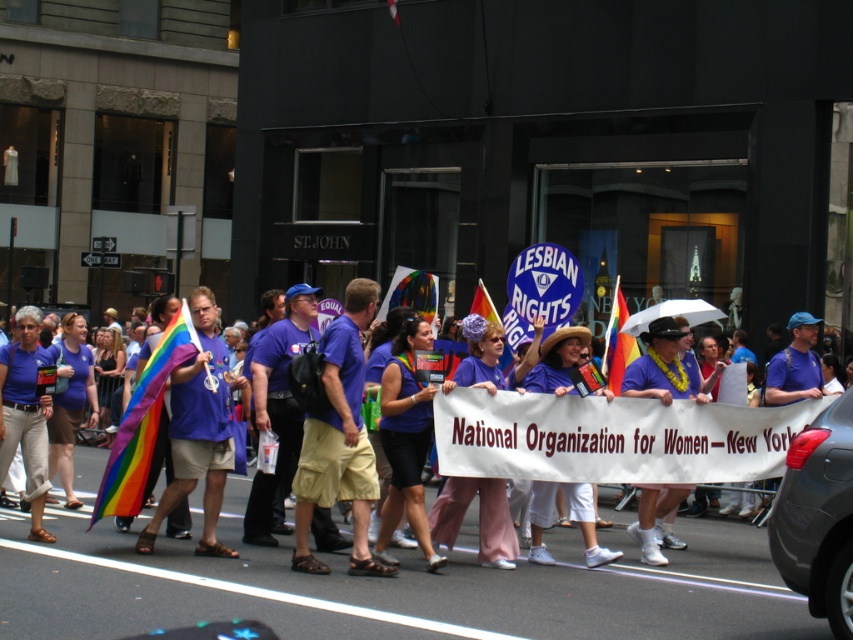
Question: Among these objects, which one is nearest to the camera?

Choices:
 (A) purple fabric shorts at center
 (B) purple cotton shirt at center
 (C) purple fabric shirt at center

Answer: (B)

Question: Does purple fabric at center appear over rainbow fabric flag at left?

Choices:
 (A) no
 (B) yes

Answer: (A)

Question: Can you confirm if purple cotton shirt at center is positioned to the right of purple fabric at center?

Choices:
 (A) yes
 (B) no

Answer: (B)

Question: Which object is closer to the camera taking this photo?

Choices:
 (A) purple fabric shirt at center
 (B) purple fabric shorts at center
 (C) matte blue shirt at center

Answer: (A)

Question: Which object is farther from the camera taking this photo?

Choices:
 (A) purple fabric at center
 (B) matte blue shirt at center

Answer: (B)

Question: Can you confirm if purple fabric at center is thinner than matte blue shirt at center?

Choices:
 (A) no
 (B) yes

Answer: (B)